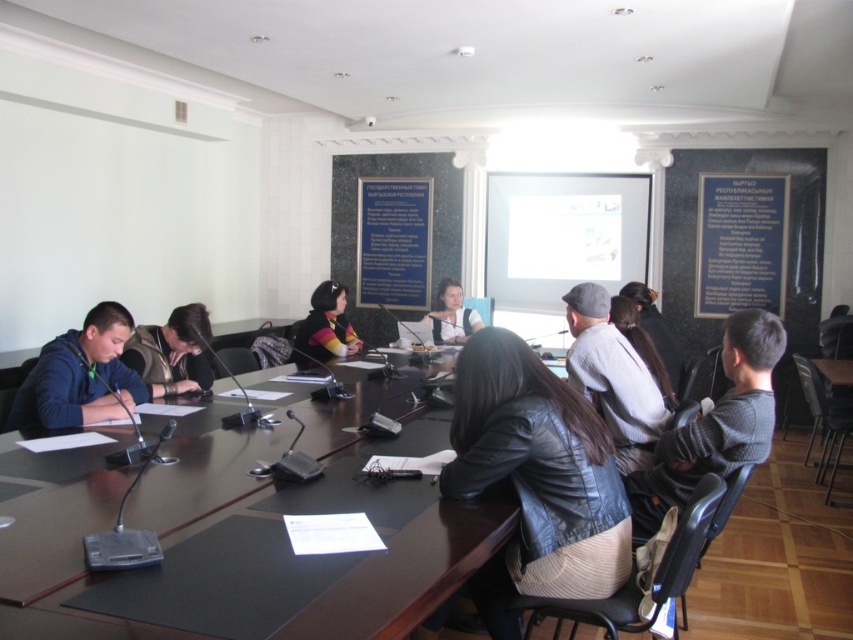
Question: Which point is farther to the camera?

Choices:
 (A) (447, 321)
 (B) (599, 301)
 (C) (498, 566)
 (D) (157, 346)

Answer: (A)

Question: Can you confirm if blue denim jacket at lower left is bigger than striped sweater at center?

Choices:
 (A) yes
 (B) no

Answer: (A)

Question: In this image, where is dark gray sweater at right located relative to blue denim jacket at lower left?

Choices:
 (A) below
 (B) above

Answer: (A)

Question: Is dark brown leather jacket at left below striped sweater at center?

Choices:
 (A) yes
 (B) no

Answer: (A)

Question: Which point is closer to the camera?

Choices:
 (A) dark gray sweater at right
 (B) matte black shirt at center
 (C) gray knit cap at center

Answer: (A)

Question: Estimate the real-world distances between objects in this image. Which object is farther from the leather jacket at center?

Choices:
 (A) black leather table at center
 (B) dark brown leather jacket at center
 (C) dark gray sweater at right

Answer: (B)